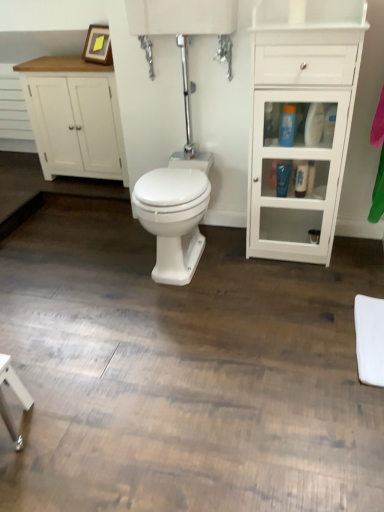
Question: Is white glossy bottle at right, the first toiletry when ordered from bottom to top, at the back of white glossy cabinet at right, which is counted as the first bathroom cabinet, starting from the right?

Choices:
 (A) no
 (B) yes

Answer: (B)

Question: Is white glossy cabinet at right, the 2th bathroom cabinet in the left-to-right sequence, thinner than white glossy bottle at right, the first toiletry when ordered from bottom to top?

Choices:
 (A) yes
 (B) no

Answer: (B)

Question: Could you tell me if white glossy cabinet at right, which is counted as the first bathroom cabinet, starting from the right, is turned towards white glossy bottle at right, which ranks as the 3th toiletry in top-to-bottom order?

Choices:
 (A) yes
 (B) no

Answer: (A)

Question: Does white glossy cabinet at right, positioned as the 1th bathroom cabinet in front-to-back order, have a lesser height compared to white glossy bottle at right, which ranks as the 3th toiletry in top-to-bottom order?

Choices:
 (A) no
 (B) yes

Answer: (A)

Question: Is white glossy cabinet at right, which is counted as the 2th bathroom cabinet, starting from the back, behind white glossy bottle at right, the first toiletry when ordered from bottom to top?

Choices:
 (A) no
 (B) yes

Answer: (A)

Question: From their relative heights in the image, would you say white glossy cabinet at right, which is counted as the 2th bathroom cabinet, starting from the back, is taller or shorter than white glossy bidet at center?

Choices:
 (A) short
 (B) tall

Answer: (B)

Question: Considering their positions, is white glossy cabinet at right, which is counted as the first bathroom cabinet, starting from the right, located in front of or behind white glossy bidet at center?

Choices:
 (A) front
 (B) behind

Answer: (A)

Question: From a real-world perspective, is white glossy cabinet at right, which is counted as the 2th bathroom cabinet, starting from the back, above or below white glossy bidet at center?

Choices:
 (A) above
 (B) below

Answer: (A)

Question: Is point (324, 52) closer or farther from the camera than point (144, 226)?

Choices:
 (A) closer
 (B) farther

Answer: (A)

Question: Is blue glossy bottle at center right, which is counted as the 1th toiletry, starting from the top, inside or outside of blue glossy lotion at center right, which appears as the second toiletry when viewed from the top?

Choices:
 (A) outside
 (B) inside

Answer: (A)

Question: In terms of height, does blue glossy bottle at center right, which is counted as the 1th toiletry, starting from the top, look taller or shorter compared to blue glossy lotion at center right, which appears as the second toiletry when viewed from the top?

Choices:
 (A) tall
 (B) short

Answer: (B)

Question: Looking at their shapes, would you say blue glossy bottle at center right, which is counted as the 1th toiletry, starting from the top, is wider or thinner than blue glossy lotion at center right, which appears as the second toiletry when viewed from the top?

Choices:
 (A) wide
 (B) thin

Answer: (A)

Question: In the image, is blue glossy bottle at center right, which is counted as the 1th toiletry, starting from the top, positioned in front of or behind blue glossy lotion at center right, which appears as the second toiletry when viewed from the top?

Choices:
 (A) front
 (B) behind

Answer: (A)

Question: Considering their positions, is wooden picture frame at upper left located in front of or behind white wood cabinet at left, the second bathroom cabinet viewed from the front?

Choices:
 (A) front
 (B) behind

Answer: (A)

Question: Looking at their shapes, would you say wooden picture frame at upper left is wider or thinner than white wood cabinet at left, which is the first bathroom cabinet from back to front?

Choices:
 (A) wide
 (B) thin

Answer: (B)